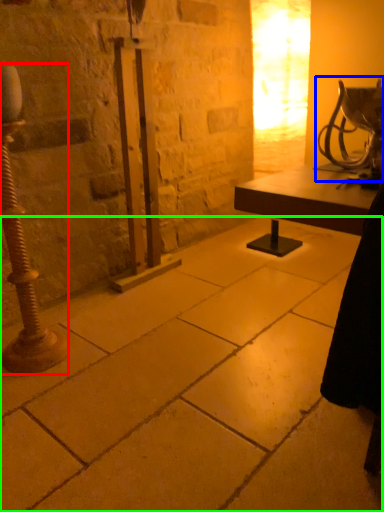
Question: Based on their relative distances, which object is nearer to pillar (highlighted by a red box)? Choose from table lamp (highlighted by a blue box) and concrete (highlighted by a green box).

Choices:
 (A) table lamp
 (B) concrete

Answer: (B)